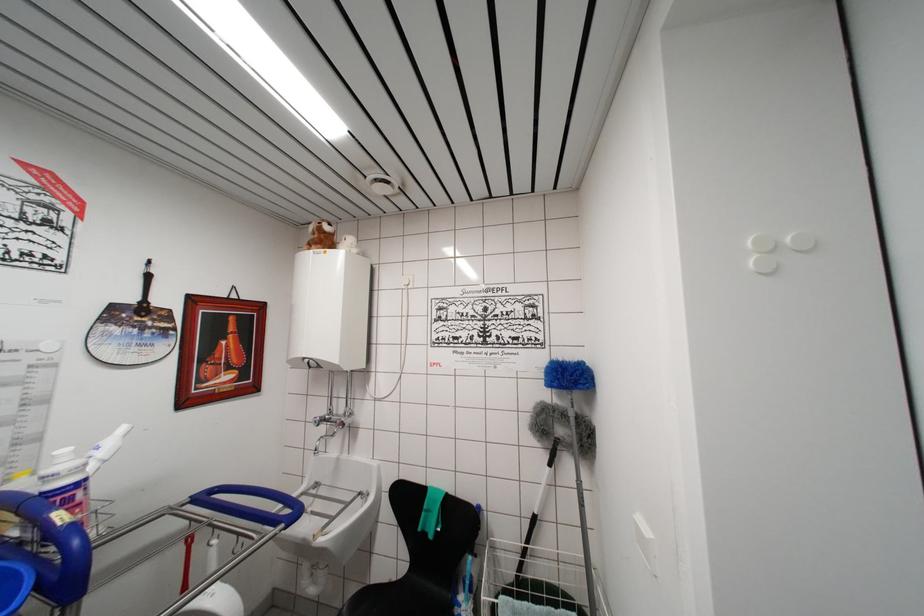
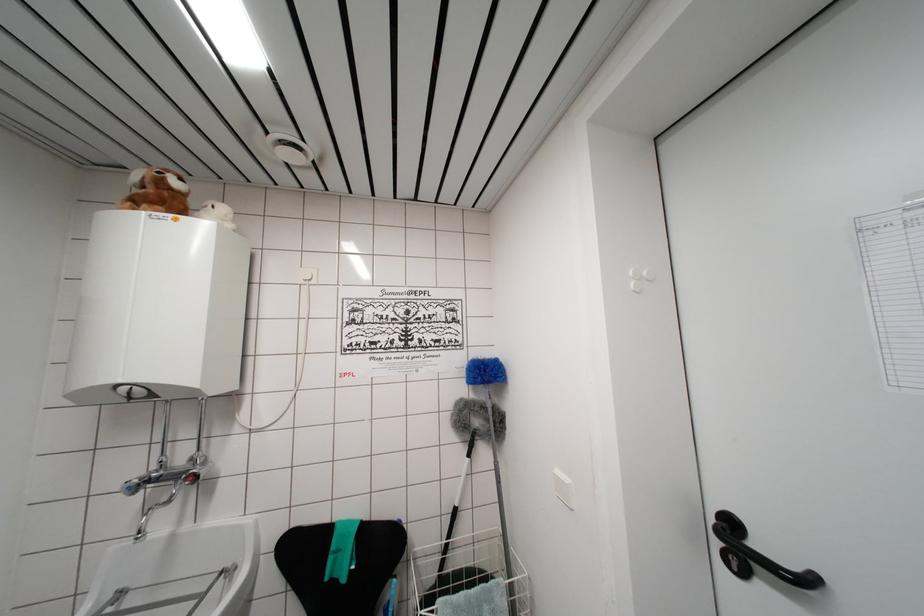
Locate, in the second image, the point that corresponds to pixel 319 426 in the first image.

(132, 493)